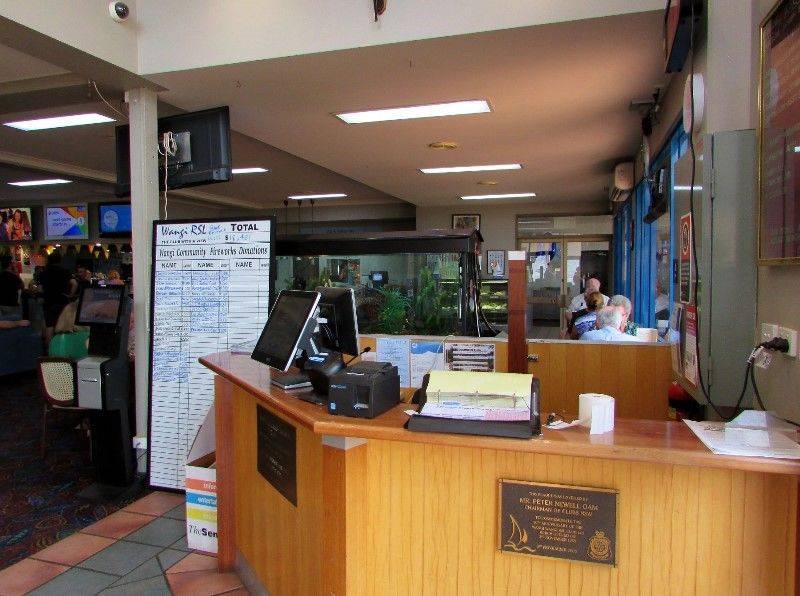
Locate an element on the screen. This screenshot has width=800, height=596. wall clock is located at coordinates (697, 98).